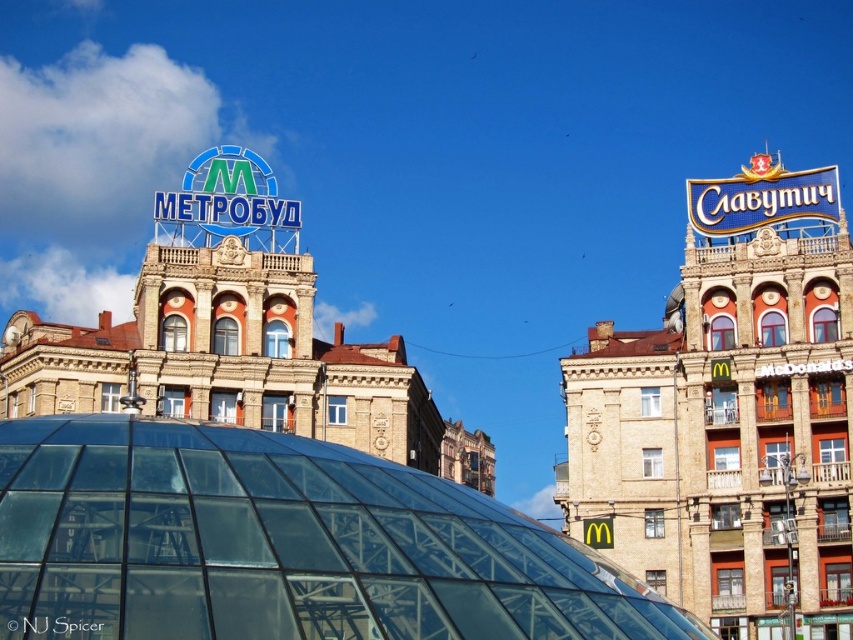
You are an architect analyzing the urban scene. You notice the transparent glass dome at center and the blue metallic signboard at upper right. Which structure is shorter in height?

The transparent glass dome at center is not as tall as the blue metallic signboard at upper right, so the transparent glass dome at center is shorter in height.

You are an architect evaluating the urban space between the transparent glass dome at center and the blue metallic signboard at upper right. Which object would require more space for a maintenance vehicle to maneuver around?

The blue metallic signboard at upper right requires more space for maneuvering around since it is larger than the transparent glass dome at center.

You are standing at the point with coordinates point (280,545) in the urban scene. What structure are you directly under?

The point (280,545) corresponds to the transparent glass dome at center, so you are directly under the transparent glass dome at center.